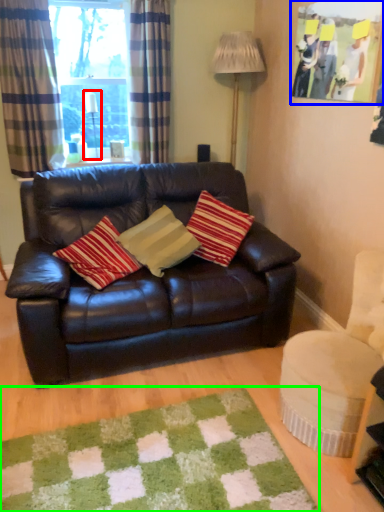
Question: Based on their relative distances, which object is farther from lamp (highlighted by a red box)? Choose from picture frame (highlighted by a blue box) and mat (highlighted by a green box).

Choices:
 (A) picture frame
 (B) mat

Answer: (B)